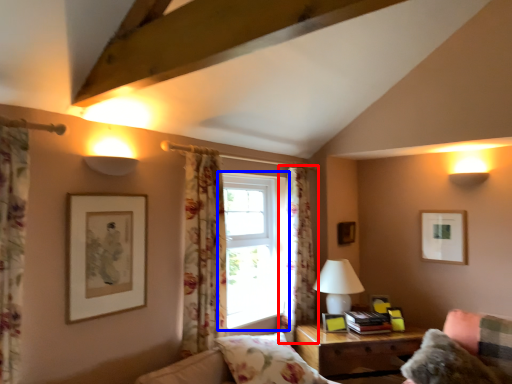
Question: Which object appears closest to the camera in this image, curtain (highlighted by a red box) or window (highlighted by a blue box)?

Choices:
 (A) curtain
 (B) window

Answer: (B)